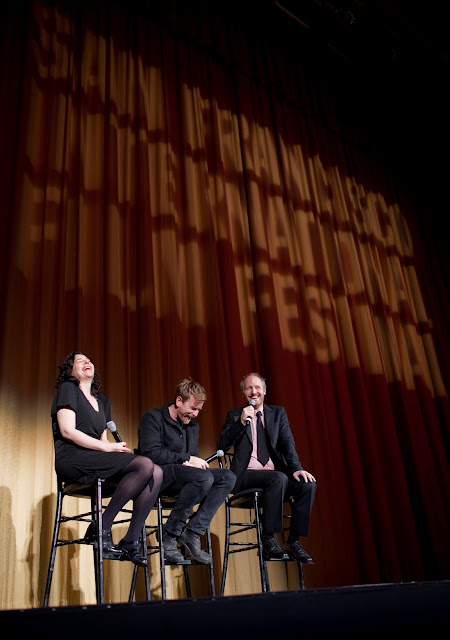
Find the location of a particular element. The image size is (450, 640). back of 3rd chair is located at coordinates (220, 461), (228, 454).